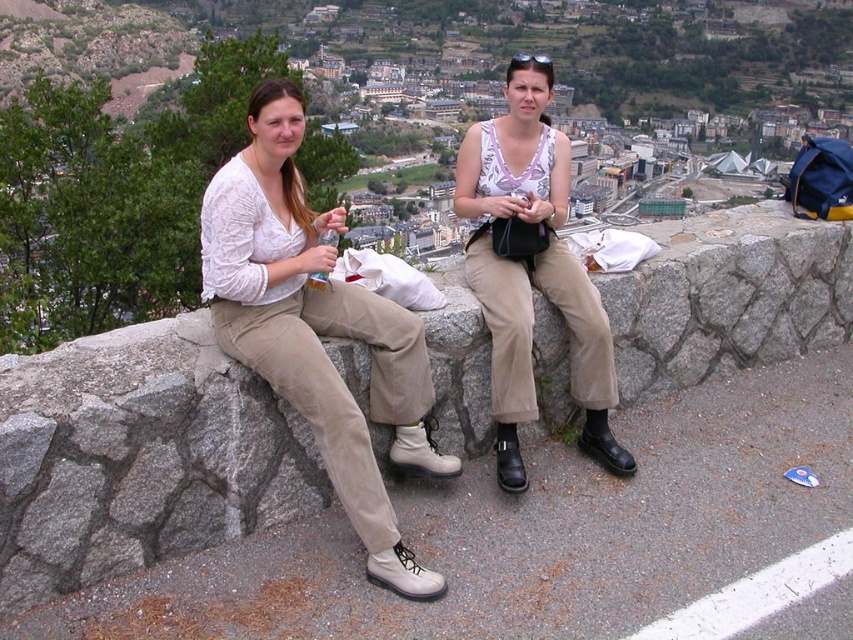
You are standing at the origin point in the image. Which direction should you move to reach the stone wall at center?

The stone wall at center is located at coordinates 0.716 on the x axis and 0.164 on the y axis. Since you are at the origin point, you should move towards the positive x and positive y directions to reach it.

You are a photographer trying to capture a candid shot of the matte white tank top at center without including the stone wall at center in the background. Based on their positions, is this possible?

The stone wall at center is in front of the matte white tank top at center, so the stone wall would block the view of the matte white tank top at center. Therefore, it is not possible to capture the matte white tank top at center without the stone wall at center in the background.